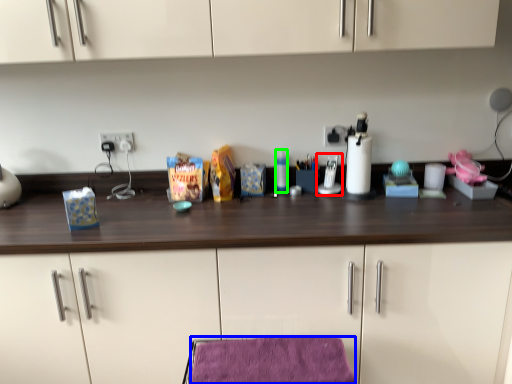
Question: Based on their relative distances, which object is farther from appliance (highlighted by a red box)? Choose from velvet (highlighted by a blue box) and bottle (highlighted by a green box).

Choices:
 (A) velvet
 (B) bottle

Answer: (A)